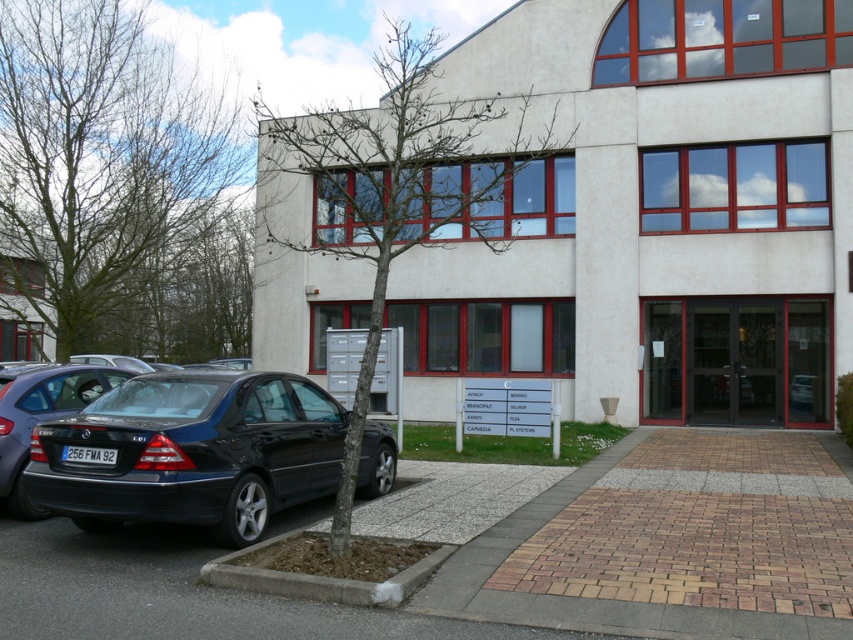
Is green leafless tree at left smaller than satin black car at lower left?

Actually, green leafless tree at left might be larger than satin black car at lower left.

Is green leafless tree at left wider than satin black car at lower left?

Correct, the width of green leafless tree at left exceeds that of satin black car at lower left.

Find the location of `green leafless tree at left`. green leafless tree at left is located at coordinates (100, 161).

Where is `green leafless tree at left`? green leafless tree at left is located at coordinates (100, 161).

Is glossy black sedan at lower left positioned in front of bare branches at center?

No.

Is glossy black sedan at lower left to the right of bare branches at center from the viewer's perspective?

Yes, glossy black sedan at lower left is to the right of bare branches at center.

Locate an element on the screen. This screenshot has height=640, width=853. glossy black sedan at lower left is located at coordinates (190, 452).

Who is more distant from viewer, (529, 138) or (405, 572)?

The point (529, 138) is behind.

Does bare branches at center have a larger size compared to concrete at lower left?

Yes, bare branches at center is bigger than concrete at lower left.

I want to click on bare branches at center, so click(393, 189).